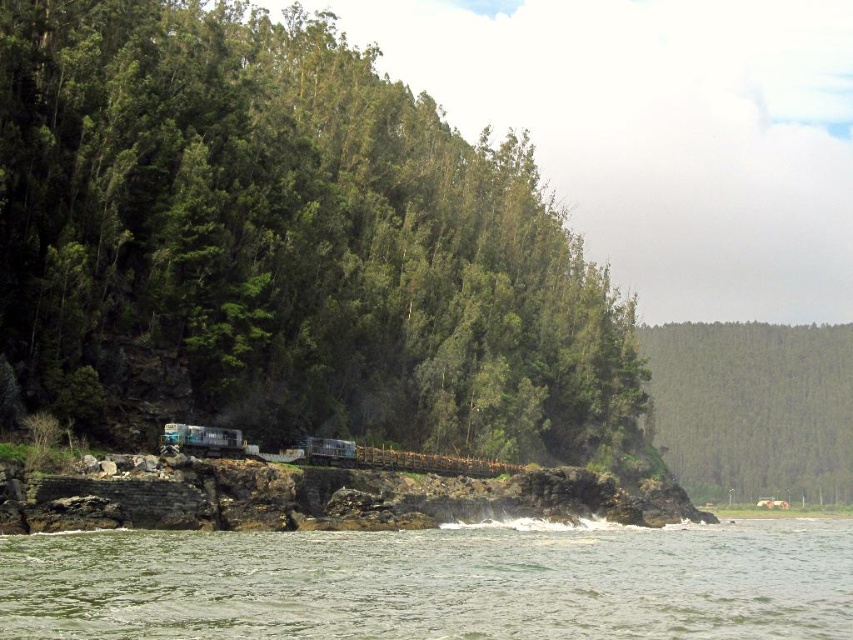
Question: Which object is the farthest from the green leafy forest at upper right?

Choices:
 (A) teal glossy recreational vehicle at center
 (B) metallic blue train at center
 (C) clear water at lower left

Answer: (A)

Question: Is clear water at lower left in front of metallic blue train at center?

Choices:
 (A) yes
 (B) no

Answer: (A)

Question: Considering the relative positions of green leafy forest at upper right and teal glossy recreational vehicle at center in the image provided, where is green leafy forest at upper right located with respect to teal glossy recreational vehicle at center?

Choices:
 (A) left
 (B) right

Answer: (B)

Question: Is green leafy trees at left above green leafy forest at upper right?

Choices:
 (A) yes
 (B) no

Answer: (A)

Question: Which of these objects is positioned closest to the metallic blue train at center?

Choices:
 (A) clear water at lower left
 (B) green leafy forest at upper right

Answer: (A)

Question: Which is nearer to the green leafy trees at left?

Choices:
 (A) clear water at lower left
 (B) teal glossy recreational vehicle at center
 (C) green leafy forest at upper right

Answer: (A)